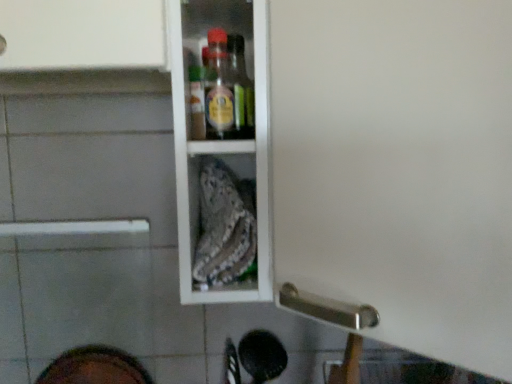
Question: Is dark brown leather shoe at lower left bigger or smaller than white glossy cabinet at upper center?

Choices:
 (A) small
 (B) big

Answer: (A)

Question: Is dark brown leather shoe at lower left in front of or behind white glossy cabinet at upper center in the image?

Choices:
 (A) front
 (B) behind

Answer: (B)

Question: From a real-world perspective, is dark brown leather shoe at lower left physically located above or below white glossy cabinet at upper center?

Choices:
 (A) below
 (B) above

Answer: (A)

Question: Considering the positions of white glossy cabinet at upper center and dark brown leather shoe at lower left in the image, is white glossy cabinet at upper center wider or thinner than dark brown leather shoe at lower left?

Choices:
 (A) wide
 (B) thin

Answer: (A)

Question: Is white glossy cabinet at upper center taller or shorter than dark brown leather shoe at lower left?

Choices:
 (A) short
 (B) tall

Answer: (B)

Question: Visually, is white glossy cabinet at upper center positioned to the left or to the right of dark brown leather shoe at lower left?

Choices:
 (A) right
 (B) left

Answer: (A)

Question: Does point (342, 97) appear closer or farther from the camera than point (109, 347)?

Choices:
 (A) farther
 (B) closer

Answer: (B)